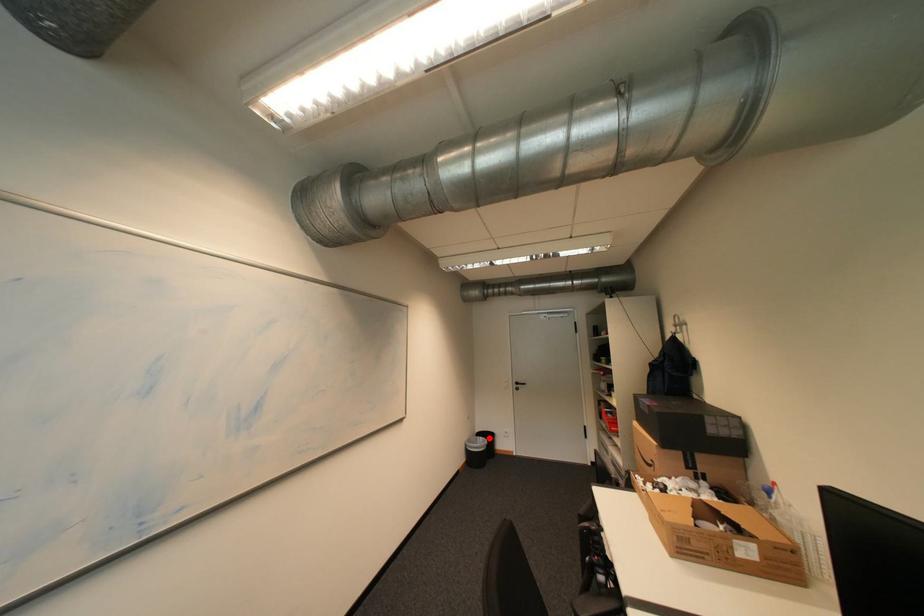
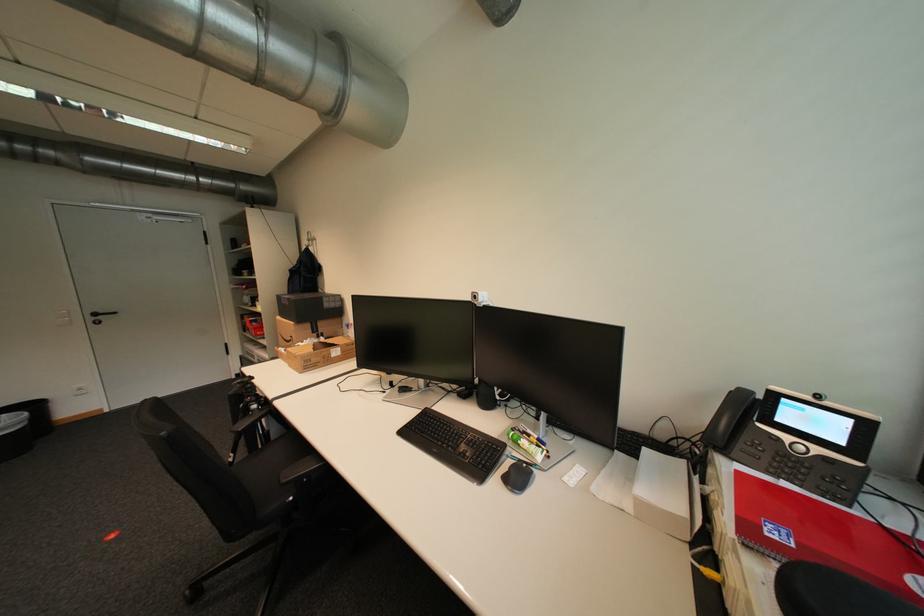
Question: A red point is marked in image1. In image2, is the corresponding 3D point closer to the camera or farther? Reply with the corresponding letter.

Choices:
 (A) The corresponding 3D point is closer.
 (B) The corresponding 3D point is farther.

Answer: (A)